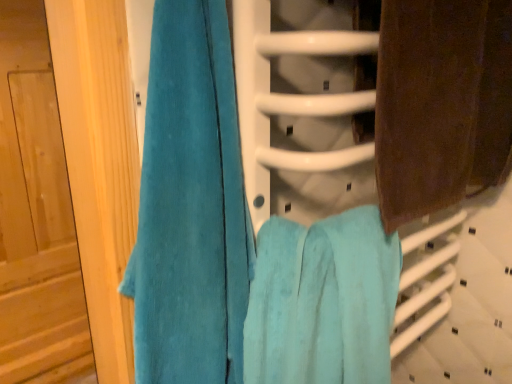
Question: Considering the relative sizes of teal plush towel at left, the first towel positioned from the left, and brown textured towel at right, the first towel when ordered from right to left, in the image provided, is teal plush towel at left, the first towel positioned from the left, smaller than brown textured towel at right, the first towel when ordered from right to left,?

Choices:
 (A) no
 (B) yes

Answer: (B)

Question: Considering the relative positions of teal plush towel at left, the first towel positioned from the left, and brown textured towel at right, acting as the 3th towel starting from the left, in the image provided, is teal plush towel at left, the first towel positioned from the left, to the left of brown textured towel at right, acting as the 3th towel starting from the left, from the viewer's perspective?

Choices:
 (A) no
 (B) yes

Answer: (B)

Question: Are teal plush towel at left, which is the third towel in right-to-left order, and brown textured towel at right, acting as the 3th towel starting from the left, located far from each other?

Choices:
 (A) no
 (B) yes

Answer: (A)

Question: Is teal plush towel at left, which is the third towel in right-to-left order, positioned behind brown textured towel at right, acting as the 3th towel starting from the left?

Choices:
 (A) yes
 (B) no

Answer: (B)

Question: Is teal plush towel at left, which is the third towel in right-to-left order, closer to the viewer compared to brown textured towel at right, the first towel when ordered from right to left?

Choices:
 (A) no
 (B) yes

Answer: (B)

Question: Considering the relative sizes of teal plush towel at left, the first towel positioned from the left, and brown textured towel at right, the first towel when ordered from right to left, in the image provided, is teal plush towel at left, the first towel positioned from the left, bigger than brown textured towel at right, the first towel when ordered from right to left,?

Choices:
 (A) yes
 (B) no

Answer: (B)

Question: From a real-world perspective, is turquoise soft towel at center, positioned as the second towel in right-to-left order, located beneath brown textured towel at right, the first towel when ordered from right to left?

Choices:
 (A) no
 (B) yes

Answer: (B)

Question: From the image's perspective, does turquoise soft towel at center, positioned as the second towel in right-to-left order, appear lower than brown textured towel at right, acting as the 3th towel starting from the left?

Choices:
 (A) no
 (B) yes

Answer: (B)

Question: Is brown textured towel at right, acting as the 3th towel starting from the left, completely or partially inside turquoise soft towel at center, positioned as the second towel in right-to-left order?

Choices:
 (A) no
 (B) yes

Answer: (A)

Question: Does turquoise soft towel at center, the 2th towel when ordered from left to right, have a greater width compared to brown textured towel at right, acting as the 3th towel starting from the left?

Choices:
 (A) yes
 (B) no

Answer: (A)

Question: Is turquoise soft towel at center, positioned as the second towel in right-to-left order, closer to the viewer compared to brown textured towel at right, acting as the 3th towel starting from the left?

Choices:
 (A) yes
 (B) no

Answer: (A)

Question: Is turquoise soft towel at center, the 2th towel when ordered from left to right, positioned beyond the bounds of brown textured towel at right, acting as the 3th towel starting from the left?

Choices:
 (A) yes
 (B) no

Answer: (A)

Question: From the image's perspective, is turquoise soft towel at center, the 2th towel when ordered from left to right, on teal plush towel at left, the first towel positioned from the left?

Choices:
 (A) yes
 (B) no

Answer: (B)